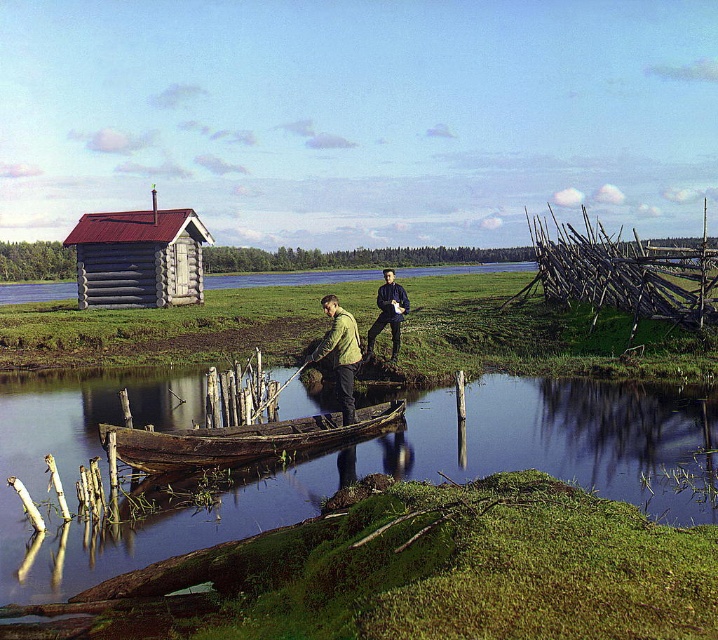
You are planning to store the wooden canoe at center and the green matte jacket at center in a storage shed. The shed has a height limit of 1.5 meters. Which item would you need to check the height of before placing it in the shed?

The wooden canoe at center is not as tall as the green matte jacket at center, so you should check the height of the green matte jacket at center before placing it in the shed to ensure it meets the 1.5 meters height limit.